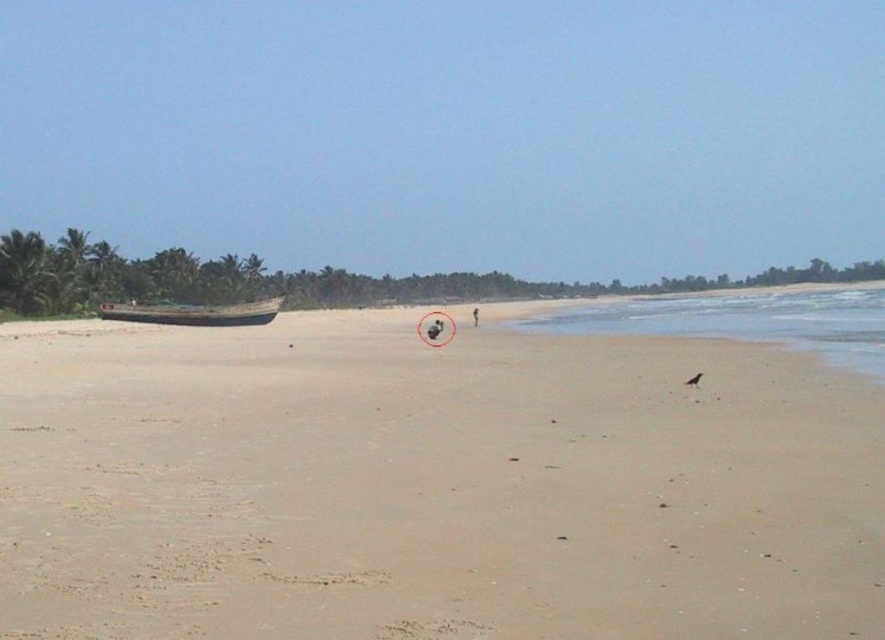
You are standing on the beach and want to place a small flag exactly at the smooth sand at center. According to the coordinates provided, where should you place the flag?

The smooth sand at center is located at point (432, 484), so you should place the flag there.

You are standing on the wooden boat at left and want to walk to the smooth sand at center. In which direction should you move?

You should move to the right because the smooth sand at center is to the right of the wooden boat at left.